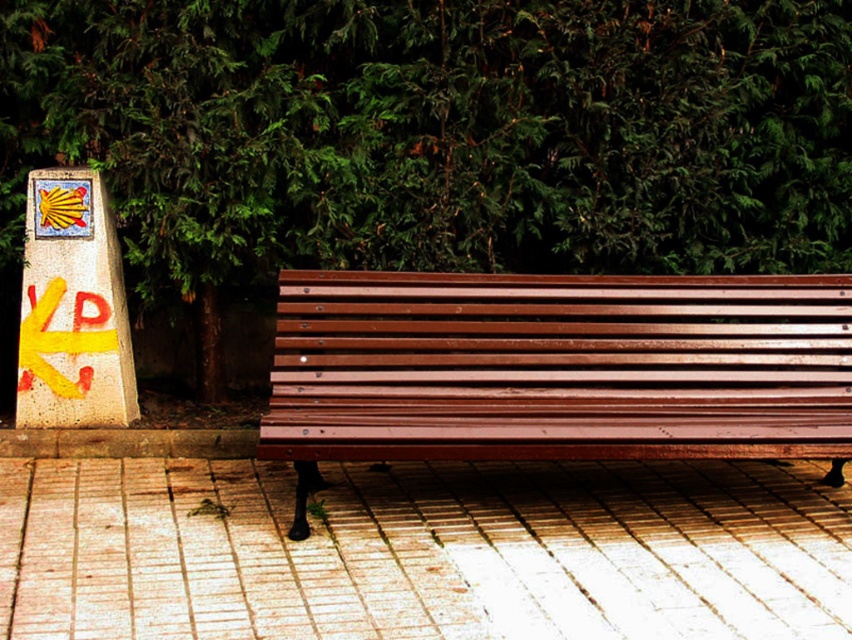
Question: Is green leafy tree at upper center to the left of yellow painted stone signpost at left from the viewer's perspective?

Choices:
 (A) yes
 (B) no

Answer: (B)

Question: Which point is farther to the camera?

Choices:
 (A) (125, 404)
 (B) (392, 221)
 (C) (629, 458)

Answer: (B)

Question: In this image, where is green leafy tree at upper center located relative to yellow painted stone signpost at left?

Choices:
 (A) below
 (B) above

Answer: (B)

Question: Among these objects, which one is nearest to the camera?

Choices:
 (A) yellow painted stone signpost at left
 (B) wooden bench at center

Answer: (B)

Question: Which of the following is the closest to the observer?

Choices:
 (A) green leafy tree at upper center
 (B) yellow painted stone signpost at left
 (C) wooden bench at center

Answer: (C)

Question: Is green leafy tree at upper center to the right of yellow painted stone signpost at left from the viewer's perspective?

Choices:
 (A) yes
 (B) no

Answer: (A)